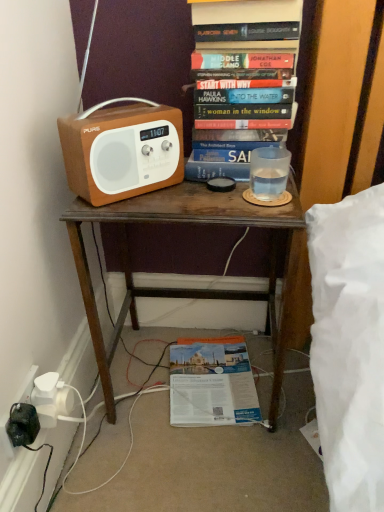
Question: From a real-world perspective, is matte brown radio at left on matte paper magazine at lower center, placed as the 1th book when sorted from back to front?

Choices:
 (A) yes
 (B) no

Answer: (A)

Question: Is matte paper magazine at lower center, placed as the 1th book when sorted from bottom to top, completely or partially inside matte brown radio at left?

Choices:
 (A) no
 (B) yes

Answer: (A)

Question: Is matte brown radio at left outside of matte paper magazine at lower center, placed as the 1th book when sorted from back to front?

Choices:
 (A) no
 (B) yes

Answer: (B)

Question: Is matte brown radio at left positioned with its back to matte paper magazine at lower center, placed as the 1th book when sorted from back to front?

Choices:
 (A) yes
 (B) no

Answer: (B)

Question: Can you confirm if matte brown radio at left is thinner than matte paper magazine at lower center, which is the second book from front to back?

Choices:
 (A) no
 (B) yes

Answer: (B)

Question: Can you confirm if matte brown radio at left is positioned to the left of matte paper magazine at lower center, placed as the 1th book when sorted from bottom to top?

Choices:
 (A) yes
 (B) no

Answer: (A)

Question: From the image's perspective, is matte brown radio at left beneath hardcover book at upper center, placed as the second book when sorted from back to front?

Choices:
 (A) yes
 (B) no

Answer: (A)

Question: From a real-world perspective, is matte brown radio at left over hardcover book at upper center, which is the first book from front to back?

Choices:
 (A) yes
 (B) no

Answer: (B)

Question: Considering the relative sizes of matte brown radio at left and hardcover book at upper center, which ranks as the 1th book in top-to-bottom order, in the image provided, is matte brown radio at left thinner than hardcover book at upper center, which ranks as the 1th book in top-to-bottom order,?

Choices:
 (A) no
 (B) yes

Answer: (B)

Question: From the image's perspective, does matte brown radio at left appear higher than hardcover book at upper center, which ranks as the 1th book in top-to-bottom order?

Choices:
 (A) yes
 (B) no

Answer: (B)

Question: From a real-world perspective, does matte brown radio at left sit lower than hardcover book at upper center, which is the first book from front to back?

Choices:
 (A) no
 (B) yes

Answer: (B)

Question: Is matte brown radio at left positioned in front of hardcover book at upper center, which is the first book from front to back?

Choices:
 (A) yes
 (B) no

Answer: (A)

Question: From the image's perspective, does hardcover book at upper center, the 2th book in the bottom-to-top sequence, appear lower than matte brown radio at left?

Choices:
 (A) yes
 (B) no

Answer: (B)